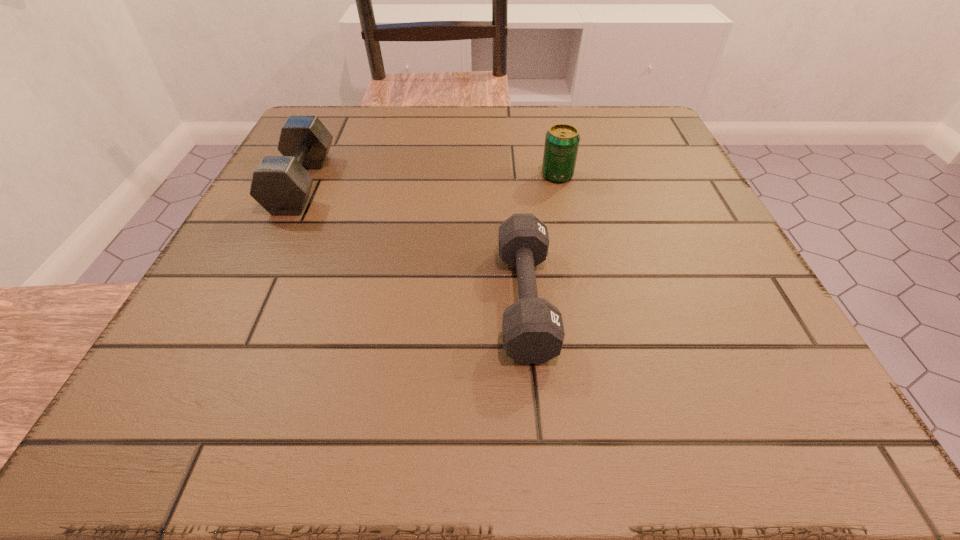
Locate an element on the screen. object that is positioned at the far left corner is located at coordinates (280, 184).

Where is `vacant space at the far edge of the desktop`? vacant space at the far edge of the desktop is located at coordinates (422, 117).

In the image, there is a desktop. Where is `free space at the near edge`? free space at the near edge is located at coordinates (403, 405).

I want to click on free space at the left edge of the desktop, so click(x=259, y=298).

In the image, there is a desktop. Where is `vacant area at the right edge`? The height and width of the screenshot is (540, 960). vacant area at the right edge is located at coordinates point(609,164).

The image size is (960, 540). I want to click on vacant space at the near left corner of the desktop, so click(247, 405).

Locate an element on the screen. This screenshot has width=960, height=540. free space at the far right corner of the desktop is located at coordinates (619, 119).

The width and height of the screenshot is (960, 540). In order to click on free space at the near right corner of the desktop in this screenshot , I will do `click(765, 413)`.

Where is `free space between the right dumbbell and the taller dumbbell`? free space between the right dumbbell and the taller dumbbell is located at coordinates (414, 242).

Find the location of a particular element. The image size is (960, 540). free point between the farther dumbbell and the beer can is located at coordinates (429, 179).